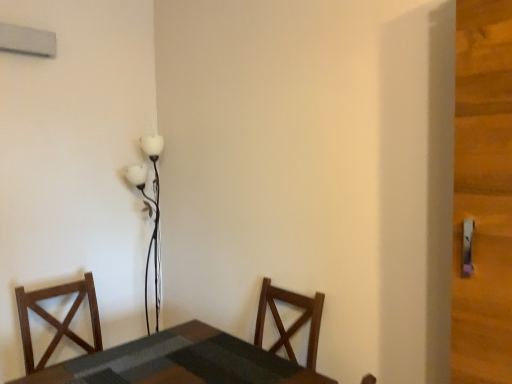
Question: Is the position of white glossy floor lamp at upper center more distant than that of smooth dark wood table at lower left?

Choices:
 (A) yes
 (B) no

Answer: (A)

Question: Does white glossy floor lamp at upper center have a lesser width compared to smooth dark wood table at lower left?

Choices:
 (A) yes
 (B) no

Answer: (A)

Question: Does white glossy floor lamp at upper center have a larger size compared to smooth dark wood table at lower left?

Choices:
 (A) yes
 (B) no

Answer: (B)

Question: Is white glossy floor lamp at upper center next to smooth dark wood table at lower left?

Choices:
 (A) no
 (B) yes

Answer: (A)

Question: Is white glossy floor lamp at upper center looking in the opposite direction of smooth dark wood table at lower left?

Choices:
 (A) yes
 (B) no

Answer: (B)

Question: Considering the positions of smooth dark wood table at lower left and white glossy floor lamp at upper center in the image, is smooth dark wood table at lower left taller or shorter than white glossy floor lamp at upper center?

Choices:
 (A) tall
 (B) short

Answer: (B)

Question: Would you say smooth dark wood table at lower left is inside or outside white glossy floor lamp at upper center?

Choices:
 (A) outside
 (B) inside

Answer: (A)

Question: Considering their positions, is smooth dark wood table at lower left located in front of or behind white glossy floor lamp at upper center?

Choices:
 (A) front
 (B) behind

Answer: (A)

Question: From a real-world perspective, is smooth dark wood table at lower left physically located above or below white glossy floor lamp at upper center?

Choices:
 (A) below
 (B) above

Answer: (A)

Question: Considering their positions, is smooth dark wood table at lower left located in front of or behind dark wood chair at left?

Choices:
 (A) behind
 (B) front

Answer: (B)

Question: Is smooth dark wood table at lower left bigger or smaller than dark wood chair at left?

Choices:
 (A) big
 (B) small

Answer: (A)

Question: Is smooth dark wood table at lower left taller or shorter than dark wood chair at left?

Choices:
 (A) tall
 (B) short

Answer: (B)

Question: Based on their positions, is smooth dark wood table at lower left located to the left or right of dark wood chair at left?

Choices:
 (A) left
 (B) right

Answer: (B)

Question: From a real-world perspective, relative to smooth dark wood table at lower left, is dark wood chair at left vertically above or below?

Choices:
 (A) above
 (B) below

Answer: (A)

Question: From the image's perspective, relative to smooth dark wood table at lower left, is dark wood chair at left above or below?

Choices:
 (A) below
 (B) above

Answer: (B)